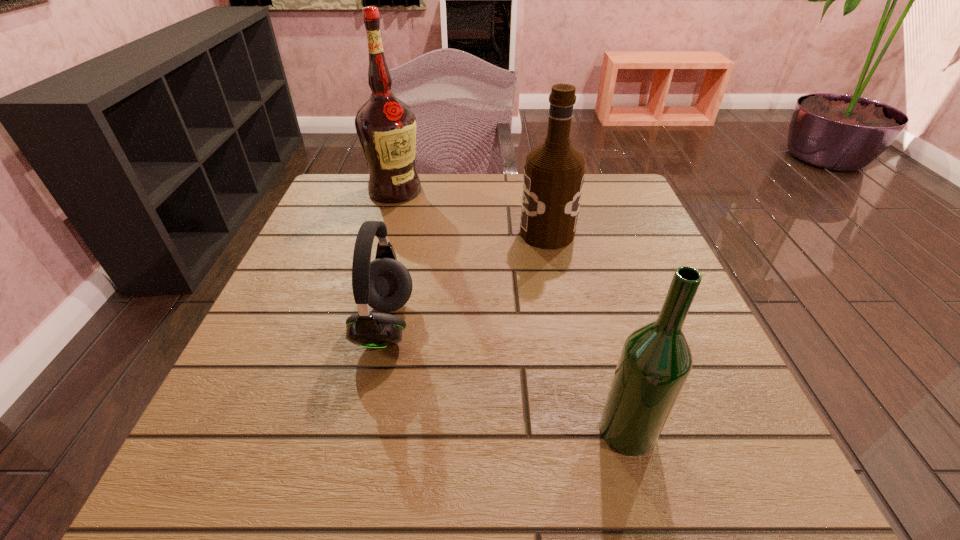
The image size is (960, 540). Identify the location of vacant area that lies between the farthest object and the nearest object. (512, 310).

Find the location of a particular element. object that stands as the third closest to the farthest alcohol is located at coordinates (655, 362).

Locate an element on the screen. object that is the third closest one to the third farthest object is located at coordinates (386, 127).

This screenshot has height=540, width=960. Find the location of `alcohol object that ranks as the closest to the nearest alcohol`. alcohol object that ranks as the closest to the nearest alcohol is located at coordinates (554, 172).

I want to click on alcohol that stands as the second closest to the leftmost alcohol, so click(655, 362).

Locate an element on the screen. The width and height of the screenshot is (960, 540). blank area in the image that satisfies the following two spatial constraints: 1. on the label of the nearest alcohol; 2. on the left side of the farthest alcohol is located at coordinates (327, 430).

The width and height of the screenshot is (960, 540). I want to click on vacant space that satisfies the following two spatial constraints: 1. on the ear cups of the third farthest object; 2. on the back side of the nearest object, so click(362, 430).

Identify the location of free region that satisfies the following two spatial constraints: 1. on the back side of the nearest object; 2. on the label of the second nearest alcohol. (573, 233).

At what (x,y) coordinates should I click in order to perform the action: click on free space that satisfies the following two spatial constraints: 1. on the label of the second farthest alcohol; 2. on the left side of the nearest alcohol. Please return your answer as a coordinate pair (x, y). This screenshot has height=540, width=960. Looking at the image, I should click on (586, 430).